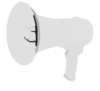
Find the location of `handle`. handle is located at coordinates (71, 61).